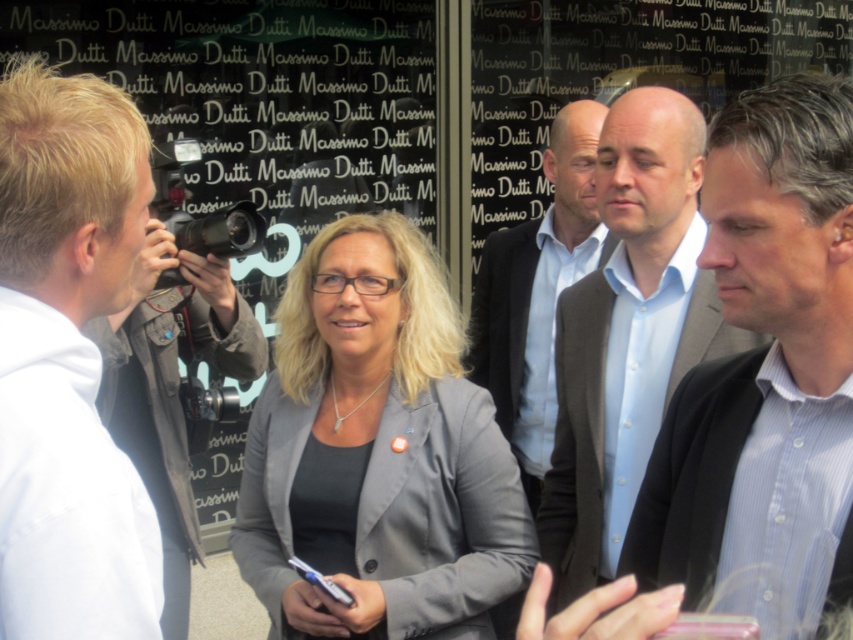
Question: Which of these objects is positioned closest to the light blue shirt at center?

Choices:
 (A) dark gray fabric business suit at left
 (B) blue striped shirt at right

Answer: (A)

Question: Which point is farther to the camera?

Choices:
 (A) dark gray suit at center
 (B) white cotton shirt at left
 (C) dark gray fabric business suit at left

Answer: (C)

Question: Does blue striped shirt at right appear under dark gray fabric business suit at left?

Choices:
 (A) no
 (B) yes

Answer: (A)

Question: Can you confirm if white cotton shirt at left is wider than light blue shirt at center?

Choices:
 (A) yes
 (B) no

Answer: (B)

Question: Which point is farther from the camera taking this photo?

Choices:
 (A) (160, 502)
 (B) (25, 77)
 (C) (643, 490)
 (D) (247, 467)

Answer: (A)

Question: Where is gray fabric jacket at center located in relation to dark gray fabric business suit at left in the image?

Choices:
 (A) left
 (B) right

Answer: (B)